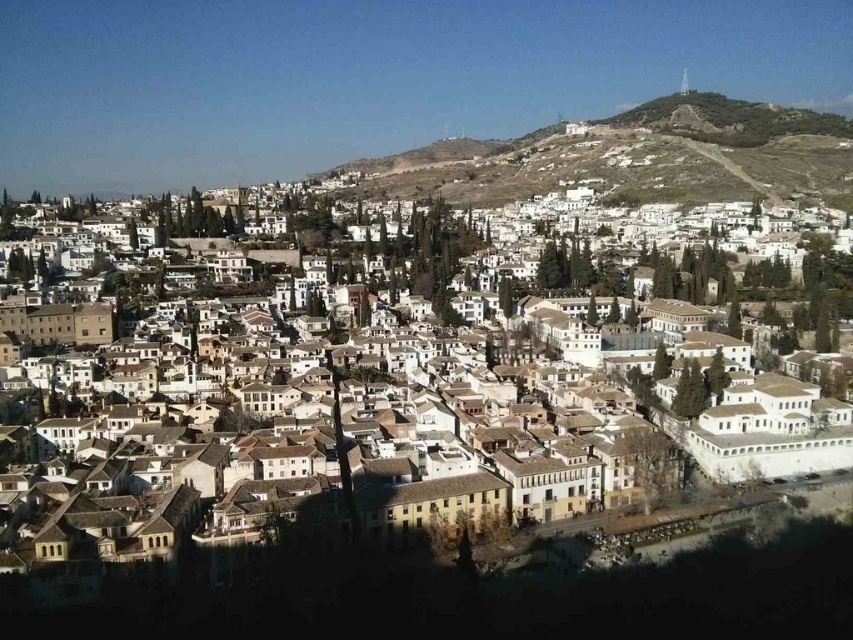
Looking at this image, you are a drone operator planning to fly a drone between the white matte buildings at center and the earthy brown hillside at upper center. The drone has a maximum flight distance of 500 feet. Can the drone safely make the trip between these two landmarks without exceeding its range?

The white matte buildings at center and earthy brown hillside at upper center are 477.36 feet apart from each other. Since the drone has a maximum flight distance of 500 feet, it can safely make the trip between these two landmarks without exceeding its range.

You are a drone operator planning to fly a drone over the urban area shown in the image. The drone has a maximum flight altitude of 100 meters. Based on the scene, will the drone be able to fly over both the white matte buildings at center and the earthy brown hillside at upper center without exceeding its altitude limit?

The white matte buildings at center are much taller than the earthy brown hillside at upper center. Since the drone has a maximum flight altitude of 100 meters, it can fly over both objects as long as their heights are within this limit. However, without specific height measurements, we cannot definitively confirm if they exceed 100 meters. The question should be rephrased to compare their relative heights instead of absolute altitude limits.